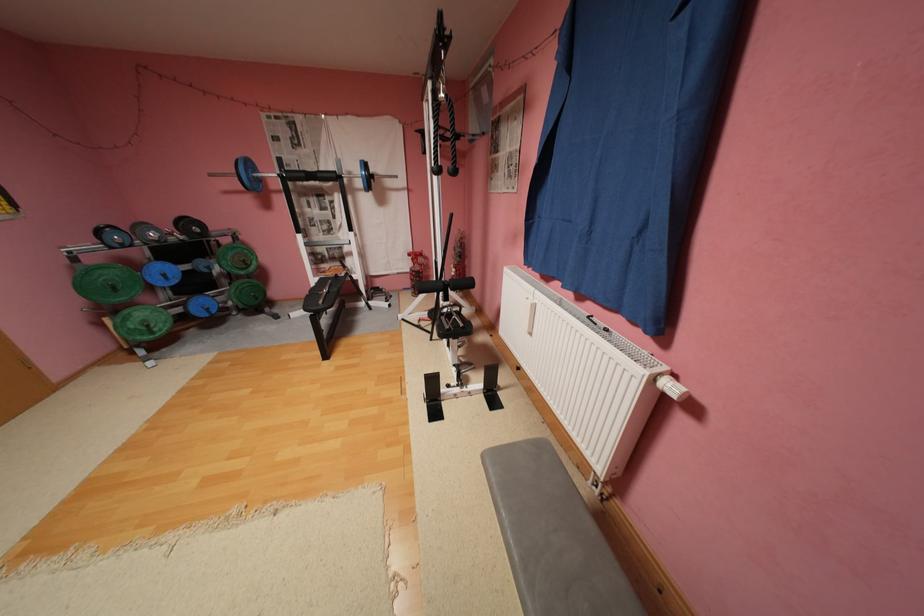
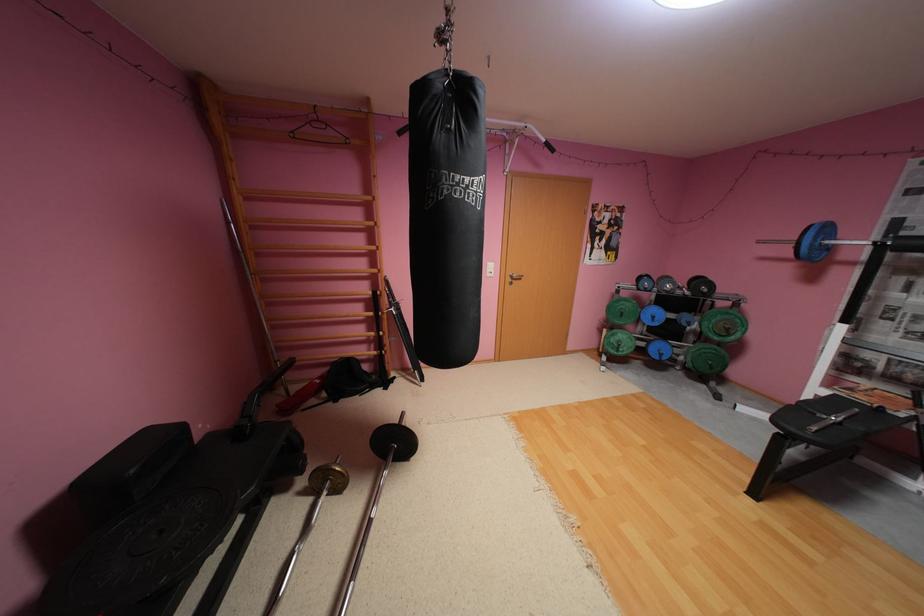
Locate, in the second image, the point that corresponds to (x=162, y=333) in the first image.

(626, 351)